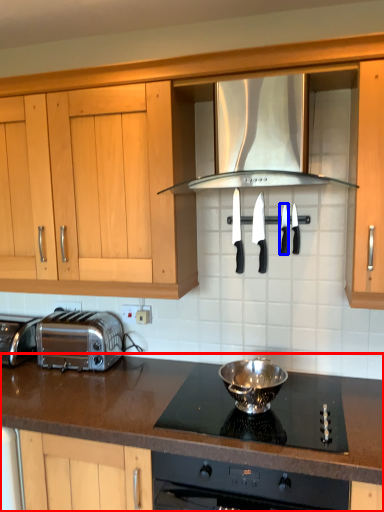
Question: Which object is further to the camera taking this photo, countertop (highlighted by a red box) or kitchen appliance (highlighted by a blue box)?

Choices:
 (A) countertop
 (B) kitchen appliance

Answer: (B)